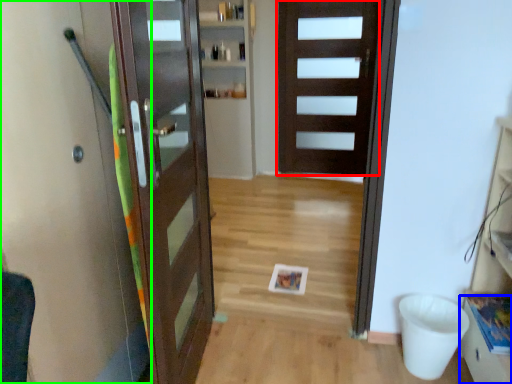
Question: Which object is the farthest from door (highlighted by a red box)? Choose among these: drawer (highlighted by a blue box) or elevator (highlighted by a green box).

Choices:
 (A) drawer
 (B) elevator

Answer: (B)